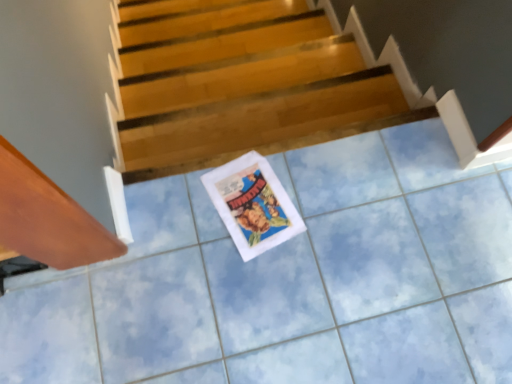
At what (x,y) coordinates should I click in order to perform the action: click on blank space to the left of white paper comic book at center. Please return your answer as a coordinate pair (x, y). This screenshot has width=512, height=384. Looking at the image, I should click on (177, 213).